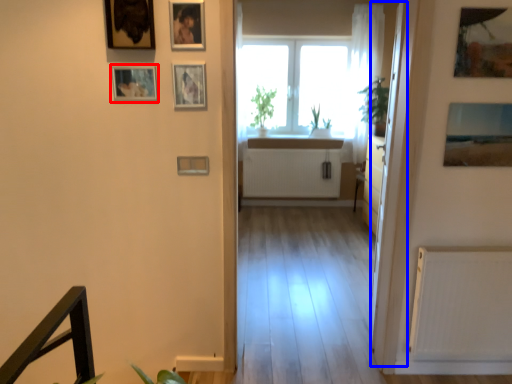
Question: Which object is closer to the camera taking this photo, picture frame (highlighted by a red box) or glass door (highlighted by a blue box)?

Choices:
 (A) picture frame
 (B) glass door

Answer: (A)